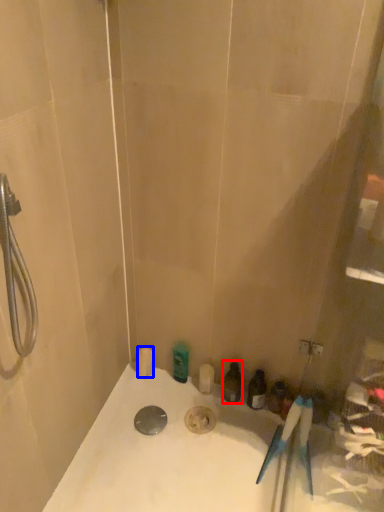
Question: Which point is further to the camera, toiletry (highlighted by a red box) or toiletry (highlighted by a blue box)?

Choices:
 (A) toiletry
 (B) toiletry

Answer: (B)